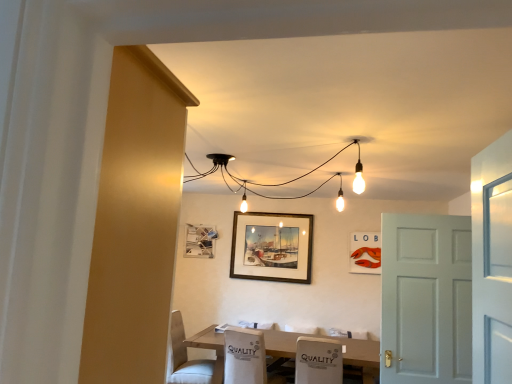
Question: Considering the relative sizes of wooden picture frame at center, which ranks as the second picture frame in right-to-left order, and matte plastic picture frame at upper right, which appears as the 1th picture frame when viewed from the right, in the image provided, is wooden picture frame at center, which ranks as the second picture frame in right-to-left order, smaller than matte plastic picture frame at upper right, which appears as the 1th picture frame when viewed from the right,?

Choices:
 (A) no
 (B) yes

Answer: (A)

Question: Does wooden picture frame at center, which ranks as the second picture frame in right-to-left order, turn towards matte plastic picture frame at upper right, which appears as the 1th picture frame when viewed from the right?

Choices:
 (A) yes
 (B) no

Answer: (B)

Question: Is wooden picture frame at center, the 2th picture frame from the left, looking in the opposite direction of matte plastic picture frame at upper right, which appears as the 1th picture frame when viewed from the right?

Choices:
 (A) yes
 (B) no

Answer: (B)

Question: Does wooden picture frame at center, which ranks as the second picture frame in right-to-left order, have a greater width compared to matte plastic picture frame at upper right, which ranks as the third picture frame in left-to-right order?

Choices:
 (A) no
 (B) yes

Answer: (A)

Question: Does wooden picture frame at center, the 2th picture frame from the left, have a larger size compared to matte plastic picture frame at upper right, which appears as the 1th picture frame when viewed from the right?

Choices:
 (A) no
 (B) yes

Answer: (B)

Question: From the image's perspective, is wooden picture frame at center, which ranks as the second picture frame in right-to-left order, below matte plastic picture frame at upper right, which ranks as the third picture frame in left-to-right order?

Choices:
 (A) no
 (B) yes

Answer: (A)

Question: Considering the relative sizes of white wood table at center and white fabric chair at lower center, arranged as the first chair when viewed from the right, in the image provided, is white wood table at center taller than white fabric chair at lower center, arranged as the first chair when viewed from the right,?

Choices:
 (A) yes
 (B) no

Answer: (A)

Question: Does white wood table at center have a greater width compared to white fabric chair at lower center, arranged as the first chair when viewed from the right?

Choices:
 (A) no
 (B) yes

Answer: (B)

Question: Would you say white wood table at center is outside white fabric chair at lower center, arranged as the first chair when viewed from the right?

Choices:
 (A) no
 (B) yes

Answer: (B)

Question: Is white wood table at center behind white fabric chair at lower center, positioned as the second chair in left-to-right order?

Choices:
 (A) yes
 (B) no

Answer: (B)

Question: Considering the relative sizes of white wood table at center and white fabric chair at lower center, arranged as the first chair when viewed from the right, in the image provided, is white wood table at center thinner than white fabric chair at lower center, arranged as the first chair when viewed from the right,?

Choices:
 (A) yes
 (B) no

Answer: (B)

Question: Is white fabric chair at lower center, positioned as the second chair in left-to-right order, at the back of white wood table at center?

Choices:
 (A) no
 (B) yes

Answer: (A)

Question: Is metallic silver picture frame at lower left, the third picture frame viewed from the right, located outside white fabric armchair at lower center?

Choices:
 (A) no
 (B) yes

Answer: (B)